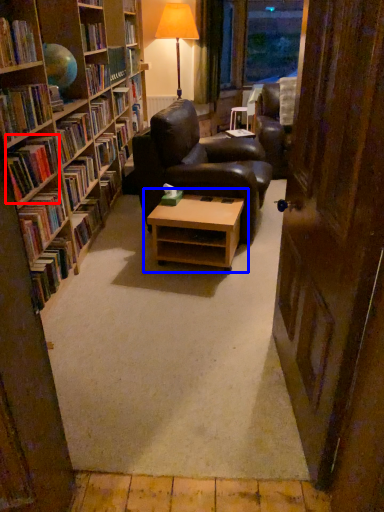
Question: Which point is further to the camera, book (highlighted by a red box) or table (highlighted by a blue box)?

Choices:
 (A) book
 (B) table

Answer: (B)